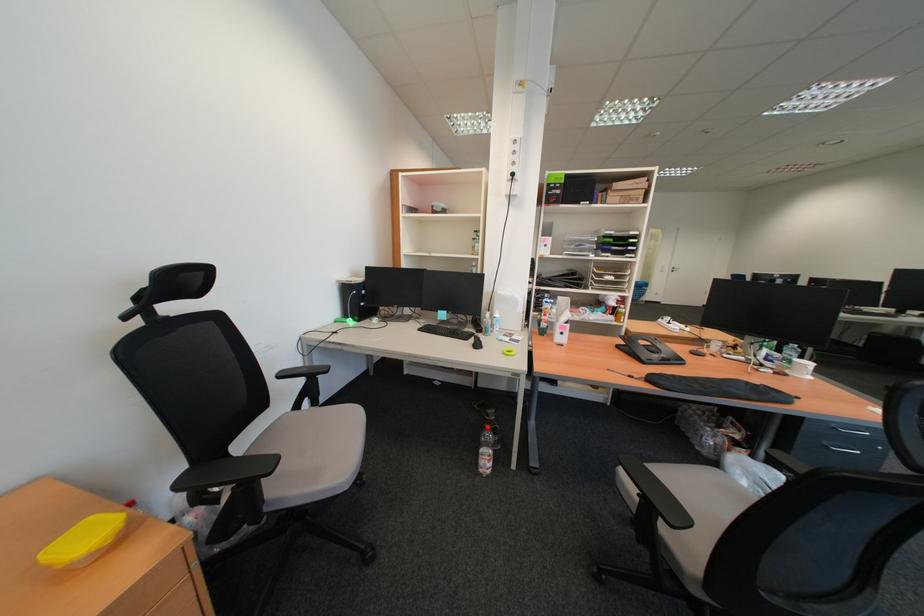
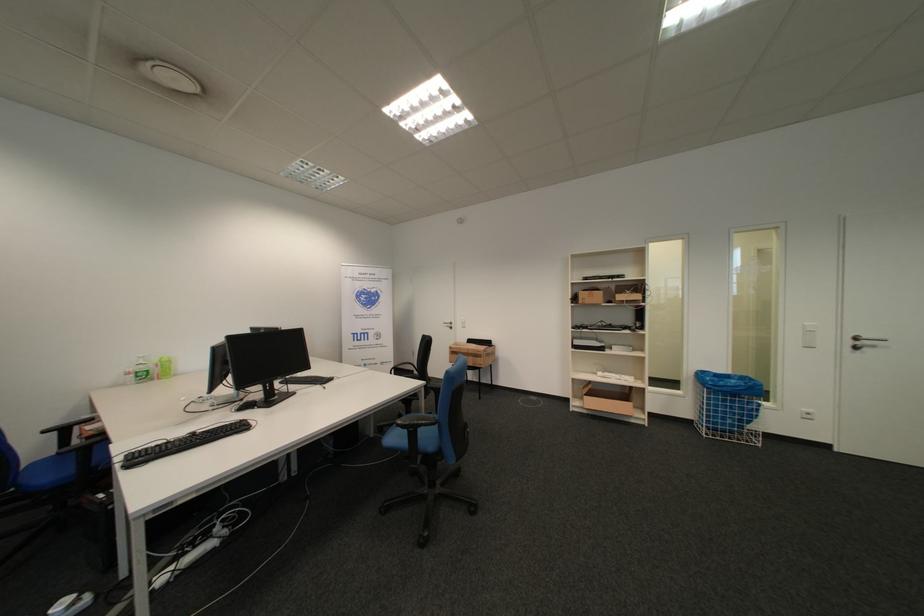
Where in the second image is the point corresponding to the point at 684,270 from the first image?

(862, 344)